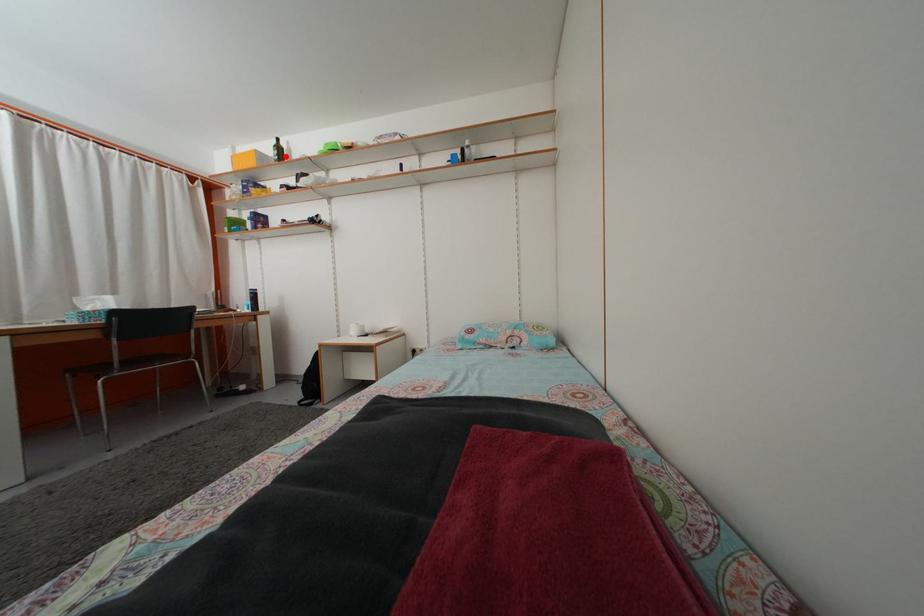
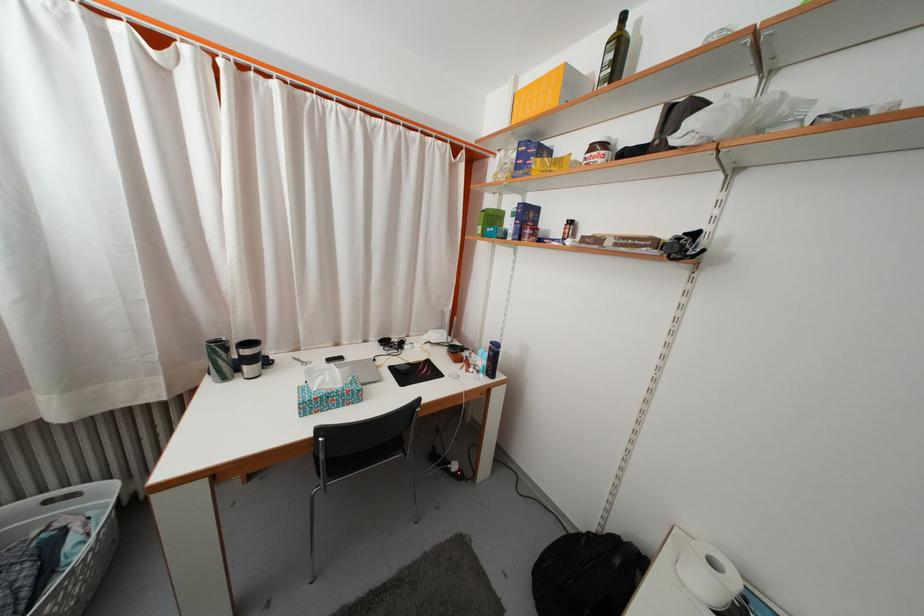
Question: I am providing you with two images of the same scene from different viewpoints. In image1, a red point is highlighted. Considering the same 3D point in image2, which of the following is correct?

Choices:
 (A) It is closer
 (B) It is farther

Answer: (B)